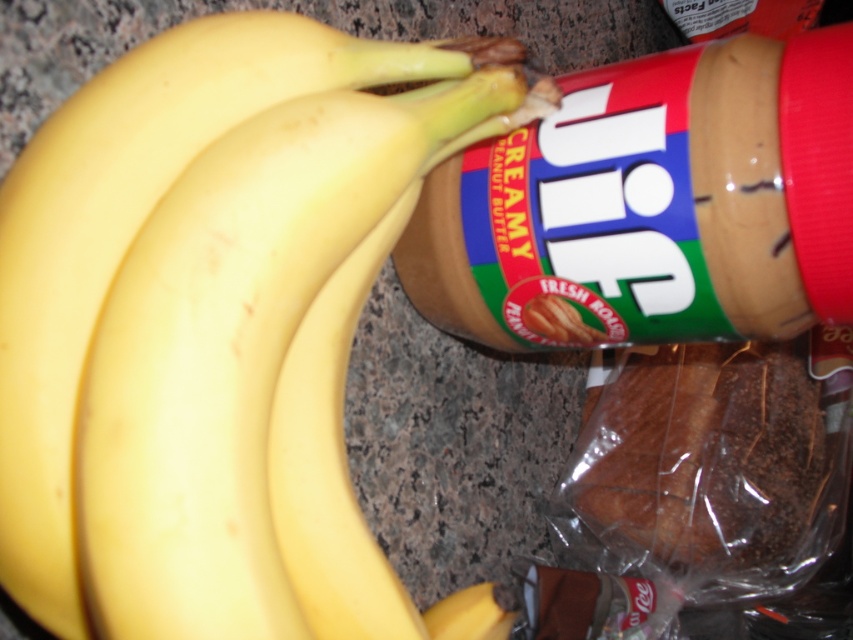
Can you confirm if yellow matte bananas at left is taller than brown/crumbly bread at right?

Yes, yellow matte bananas at left is taller than brown/crumbly bread at right.

Between point (67, 600) and point (733, 563), which one is positioned behind?

Positioned behind is point (733, 563).

The width and height of the screenshot is (853, 640). I want to click on yellow matte bananas at left, so click(213, 323).